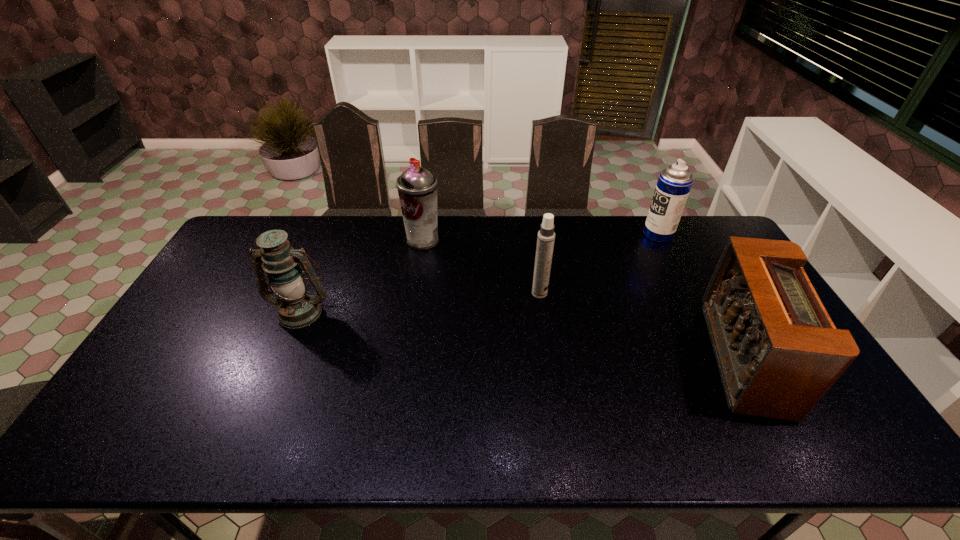
Find the location of a particular element. free location at the near right corner is located at coordinates (853, 443).

At what (x,y) coordinates should I click in order to perform the action: click on free space between the leftmost aerosol can and the oil lamp. Please return your answer as a coordinate pair (x, y). The width and height of the screenshot is (960, 540). Looking at the image, I should click on (362, 276).

Image resolution: width=960 pixels, height=540 pixels. I want to click on free space between the oil lamp and the radio receiver, so click(x=522, y=334).

Locate an element on the screen. empty space that is in between the leftmost aerosol can and the radio receiver is located at coordinates (584, 299).

Where is `free spot between the oil lamp and the radio receiver`? The width and height of the screenshot is (960, 540). free spot between the oil lamp and the radio receiver is located at coordinates (522, 334).

Find the location of a particular element. The width and height of the screenshot is (960, 540). free spot between the radio receiver and the leftmost object is located at coordinates (522, 334).

Where is `empty space between the radio receiver and the nearest aerosol can`? This screenshot has height=540, width=960. empty space between the radio receiver and the nearest aerosol can is located at coordinates click(641, 325).

Locate an element on the screen. free space between the rightmost aerosol can and the radio receiver is located at coordinates (701, 295).

Where is `vacant area that lies between the radio receiver and the second object from left to right`? The width and height of the screenshot is (960, 540). vacant area that lies between the radio receiver and the second object from left to right is located at coordinates (584, 299).

Select which object is the second closest to the oil lamp. Please provide its 2D coordinates. Your answer should be formatted as a tuple, i.e. [(x, y)], where the tuple contains the x and y coordinates of a point satisfying the conditions above.

[(546, 236)]